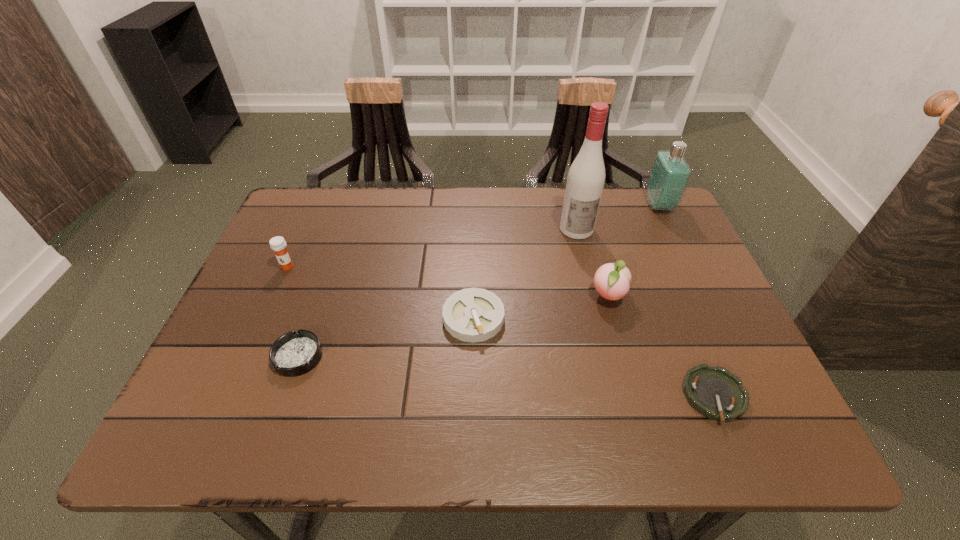
Where is `free space between the sixth shortest object and the third object from left to right`? This screenshot has height=540, width=960. free space between the sixth shortest object and the third object from left to right is located at coordinates (566, 261).

I want to click on unoccupied position between the tallest ashtray and the perfume, so click(566, 261).

Locate an element on the screen. This screenshot has width=960, height=540. vacant point located between the peach and the fifth nearest object is located at coordinates 448,282.

Locate an element on the screen. This screenshot has height=540, width=960. free space that is in between the medicine and the shortest object is located at coordinates (501, 332).

The image size is (960, 540). I want to click on empty space that is in between the medicine and the farthest object, so click(473, 236).

The height and width of the screenshot is (540, 960). I want to click on vacant area between the peach and the farthest object, so click(x=634, y=251).

You are a GUI agent. You are given a task and a screenshot of the screen. Output one action in this format:
    pyautogui.click(x=<x>, y=<y>)
    Task: Click on the vacant point located between the tallest ashtray and the farthest object
    The height and width of the screenshot is (540, 960).
    Given the screenshot: What is the action you would take?
    pyautogui.click(x=566, y=261)

Identify which object is located as the second nearest to the second farthest object. Please provide its 2D coordinates. Your answer should be formatted as a tuple, i.e. [(x, y)], where the tuple contains the x and y coordinates of a point satisfying the conditions above.

[(670, 174)]

The image size is (960, 540). Identify the location of the sixth closest object to the shortest ashtray. (278, 244).

Identify which ashtray is located as the second nearest to the second ashtray from left to right. Please provide its 2D coordinates. Your answer should be formatted as a tuple, i.e. [(x, y)], where the tuple contains the x and y coordinates of a point satisfying the conditions above.

[(716, 393)]